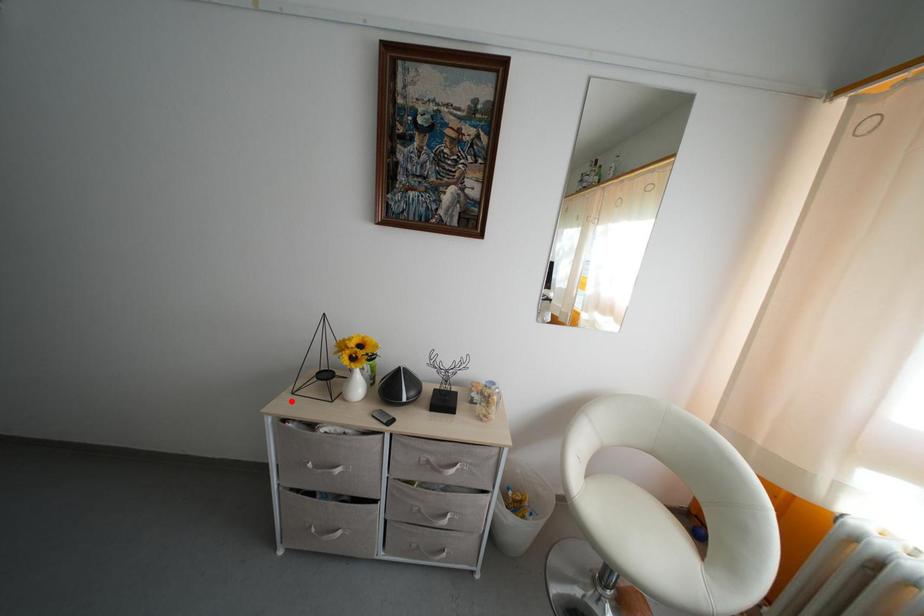
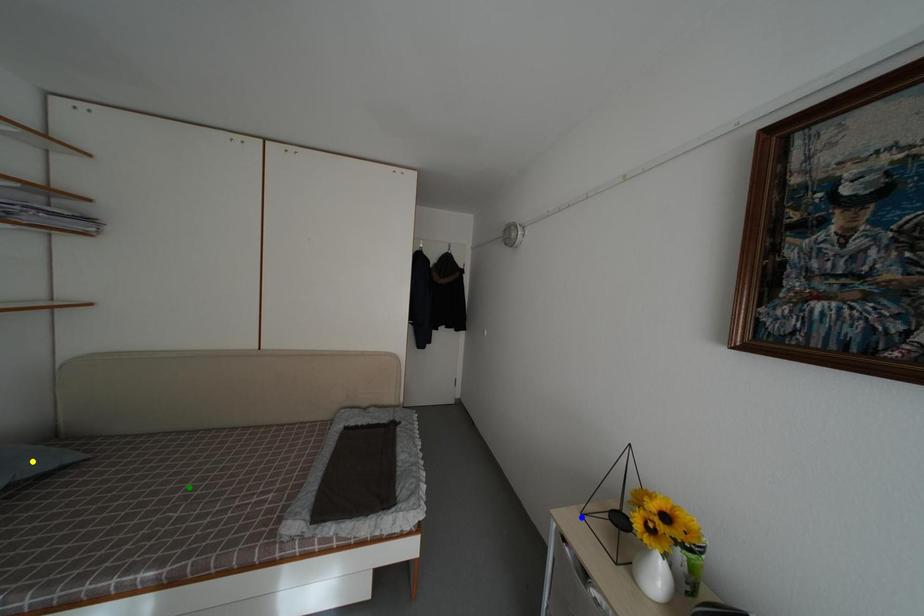
Question: I am providing you with two images of the same scene from different viewpoints. A red point is marked on the first image. You are given multiple points on the second image. Which spot in image 2 lines up with the point in image 1?

Choices:
 (A) green point
 (B) blue point
 (C) yellow point

Answer: (B)